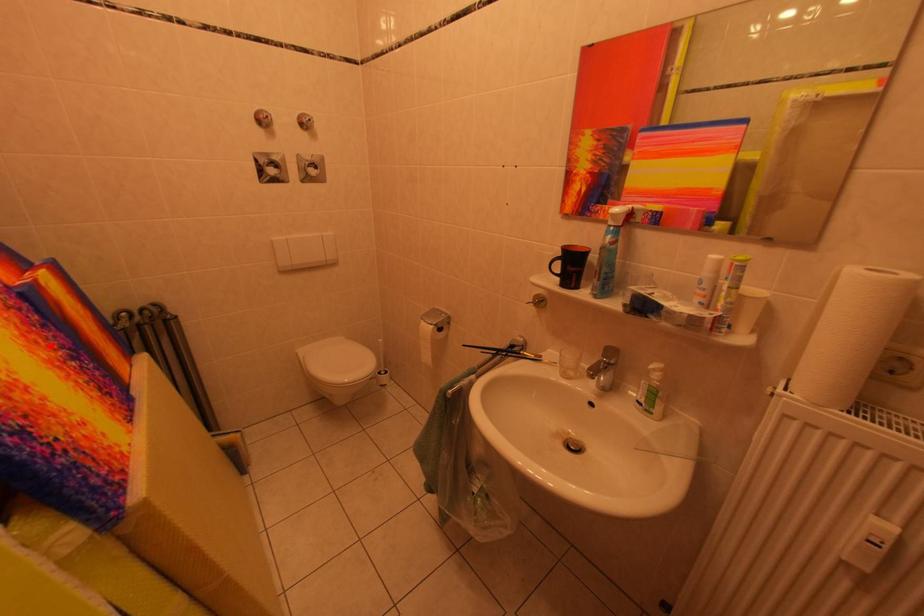
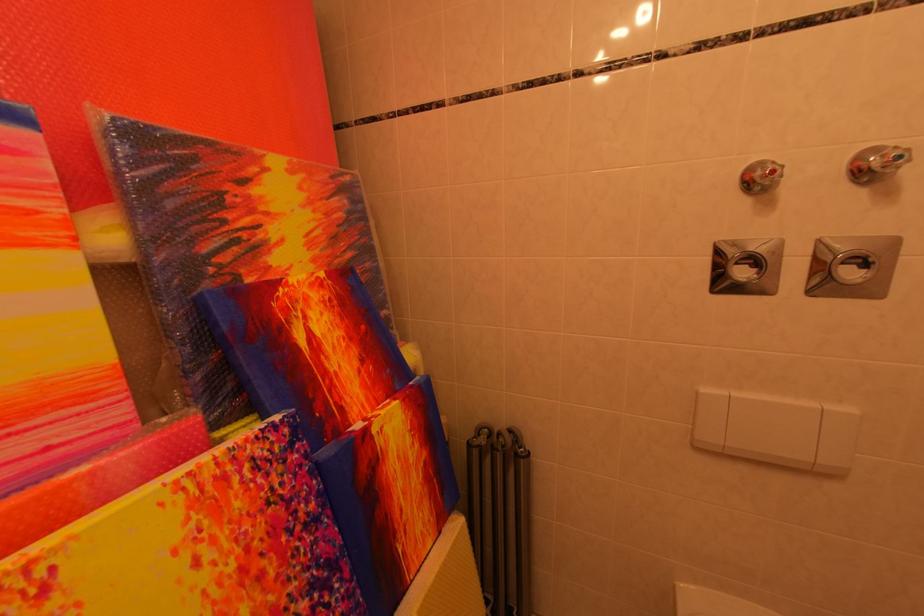
Question: I am providing you with two images of the same scene from different viewpoints. Given a red point in image1, look at the same physical point in image2. Is it:

Choices:
 (A) Closer to the viewpoint
 (B) Farther from the viewpoint

Answer: (A)